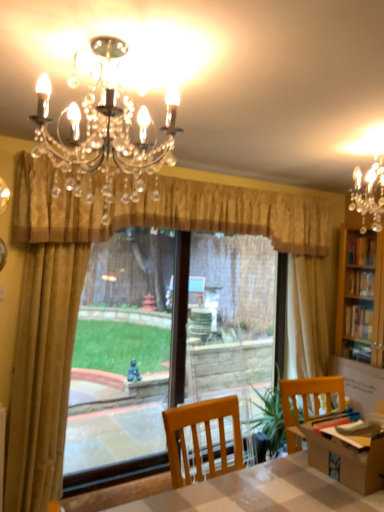
Question: Does matte black chandelier at upper center appear on the left side of gold fabric curtain at left, the 1th curtain from the left?

Choices:
 (A) yes
 (B) no

Answer: (B)

Question: From the image's perspective, would you say matte black chandelier at upper center is positioned over gold fabric curtain at left, placed as the second curtain when sorted from right to left?

Choices:
 (A) yes
 (B) no

Answer: (A)

Question: Can you confirm if matte black chandelier at upper center is positioned to the right of gold fabric curtain at left, placed as the second curtain when sorted from right to left?

Choices:
 (A) no
 (B) yes

Answer: (B)

Question: Is the depth of matte black chandelier at upper center greater than that of gold fabric curtain at left, the 1th curtain from the left?

Choices:
 (A) yes
 (B) no

Answer: (B)

Question: Considering the relative sizes of matte black chandelier at upper center and gold fabric curtain at left, placed as the second curtain when sorted from right to left, in the image provided, is matte black chandelier at upper center bigger than gold fabric curtain at left, placed as the second curtain when sorted from right to left,?

Choices:
 (A) yes
 (B) no

Answer: (B)

Question: In the image, is matte black chandelier at upper center positioned in front of or behind gold textured valance at center, which is counted as the 1th curtain, starting from the right?

Choices:
 (A) behind
 (B) front

Answer: (B)

Question: Considering the positions of point (99, 131) and point (256, 224), is point (99, 131) closer or farther from the camera than point (256, 224)?

Choices:
 (A) closer
 (B) farther

Answer: (A)

Question: Based on their positions, is matte black chandelier at upper center located to the left or right of gold textured valance at center, which is counted as the 1th curtain, starting from the right?

Choices:
 (A) right
 (B) left

Answer: (B)

Question: From the image's perspective, is matte black chandelier at upper center positioned above or below gold textured valance at center, the 2th curtain when ordered from left to right?

Choices:
 (A) below
 (B) above

Answer: (B)

Question: From a real-world perspective, relative to smooth white table at center, is matte black chandelier at upper center vertically above or below?

Choices:
 (A) below
 (B) above

Answer: (B)

Question: Looking at their shapes, would you say matte black chandelier at upper center is wider or thinner than smooth white table at center?

Choices:
 (A) thin
 (B) wide

Answer: (A)

Question: From their relative heights in the image, would you say matte black chandelier at upper center is taller or shorter than smooth white table at center?

Choices:
 (A) short
 (B) tall

Answer: (A)

Question: Is matte black chandelier at upper center inside the boundaries of smooth white table at center, or outside?

Choices:
 (A) outside
 (B) inside

Answer: (A)

Question: Considering the positions of gold textured valance at center, which is counted as the 1th curtain, starting from the right, and translucent plastic screen door at center in the image, is gold textured valance at center, which is counted as the 1th curtain, starting from the right, wider or thinner than translucent plastic screen door at center?

Choices:
 (A) thin
 (B) wide

Answer: (B)

Question: Would you say gold textured valance at center, the 2th curtain when ordered from left to right, is inside or outside translucent plastic screen door at center?

Choices:
 (A) outside
 (B) inside

Answer: (A)